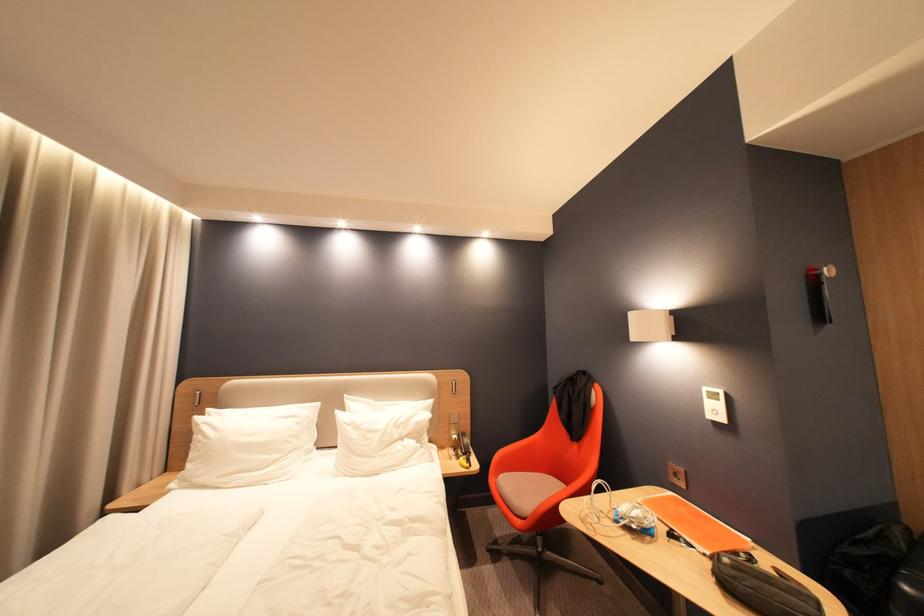
At what (x,y) coordinates should I click in order to perform the action: click on glass bottle. Please return your answer as a coordinate pair (x, y). This screenshot has height=616, width=924. Looking at the image, I should click on (819, 293).